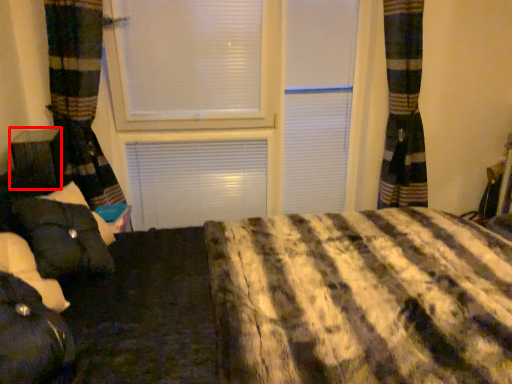
Question: From the image's perspective, where is furniture (annotated by the red box) located relative to bean bag chair?

Choices:
 (A) above
 (B) below

Answer: (A)